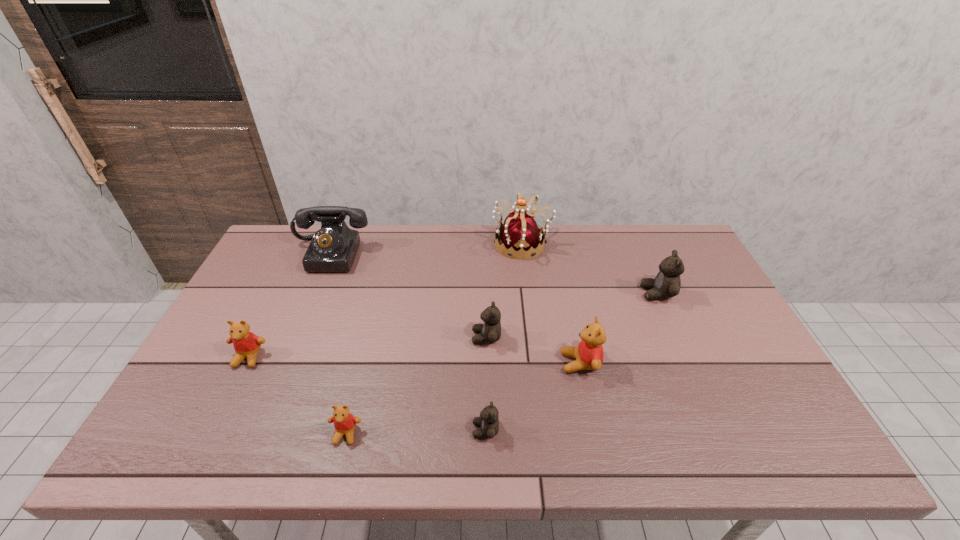
I want to click on vacant area at the far right corner of the desktop, so point(663,235).

In the image, there is a desktop. Where is `blank space at the near right corner`? The height and width of the screenshot is (540, 960). blank space at the near right corner is located at coordinates (797, 448).

You are a GUI agent. You are given a task and a screenshot of the screen. Output one action in this format:
    pyautogui.click(x=<x>, y=<y>)
    Task: Click on the vacant area that lies between the second smallest brown teddy bear and the biggest red teddy bear
    The width and height of the screenshot is (960, 540).
    Given the screenshot: What is the action you would take?
    pyautogui.click(x=534, y=350)

Find the location of a particular element. The image size is (960, 540). free space between the tallest object and the telephone is located at coordinates (426, 249).

You are a GUI agent. You are given a task and a screenshot of the screen. Output one action in this format:
    pyautogui.click(x=<x>, y=<y>)
    Task: Click on the free space between the tallest object and the fifth teddy bear from left to right
    The height and width of the screenshot is (540, 960).
    Given the screenshot: What is the action you would take?
    pyautogui.click(x=551, y=303)

Image resolution: width=960 pixels, height=540 pixels. What are the coordinates of `free point between the third farthest object and the tallest object` in the screenshot? It's located at (589, 269).

Locate an element on the screen. This screenshot has width=960, height=540. free point between the tiara and the leftmost teddy bear is located at coordinates (385, 301).

At what (x,y) coordinates should I click in order to perform the action: click on free spot between the second farthest brown teddy bear and the second teddy bear from right to left. Please return your answer as a coordinate pair (x, y). This screenshot has height=540, width=960. Looking at the image, I should click on (534, 350).

The height and width of the screenshot is (540, 960). I want to click on vacant space that's between the leftmost teddy bear and the second teddy bear from right to left, so click(415, 360).

In order to click on vacant area that lies between the tiara and the smallest red teddy bear in this screenshot , I will do `click(434, 339)`.